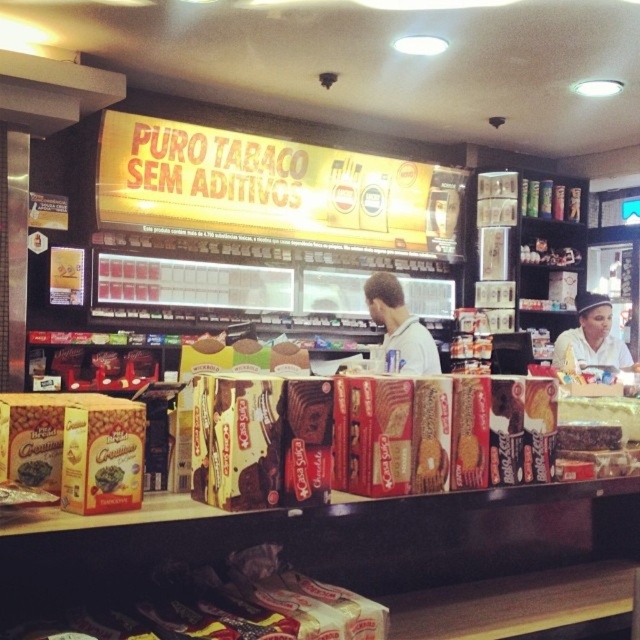
You are a customer in the store and want to pick up both the gray fabric shirt at center and the shiny chocolate bar at center. How far apart are these two items?

The gray fabric shirt at center and the shiny chocolate bar at center are 8.65 feet apart from each other.

You are standing in the convenience store and want to reach both the point at coordinates (29, 476) and the point at coordinates (116, 470). Which point is closer to you?

The point at coordinates (29, 476) is closer to you because it is further to the viewer than the point at coordinates (116, 470).

You are a customer in the store and want to grab both the brown matte cookie at center and the shiny chocolate bar at center. Can you reach both items at the same time with your hands without moving your body?

The brown matte cookie at center is 4.96 inches away from the shiny chocolate bar at center. Since the average human hand span can reach about 8 inches, you can easily reach both items at the same time without moving your body.